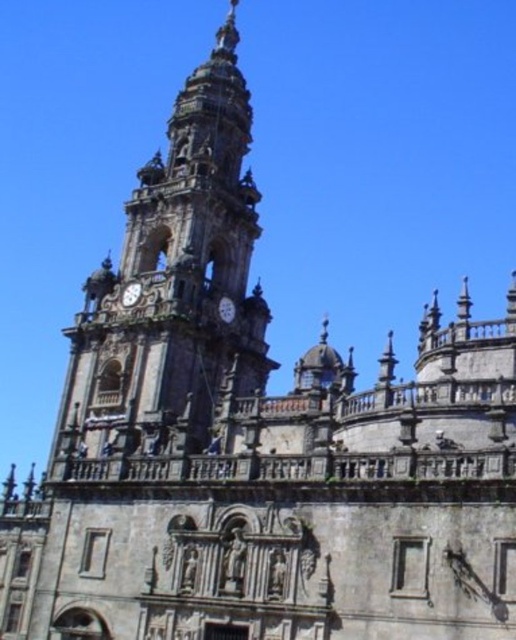
Question: Estimate the real-world distances between objects in this image. Which object is farther from the matte gray clock at center?

Choices:
 (A) silver metallic clock at center
 (B) stone clock tower at center

Answer: (B)

Question: Which of the following is the closest to the observer?

Choices:
 (A) stone clock tower at center
 (B) matte gray clock at center
 (C) silver metallic clock at center

Answer: (A)

Question: Is stone clock tower at center bigger than matte gray clock at center?

Choices:
 (A) yes
 (B) no

Answer: (A)

Question: Is stone clock tower at center positioned at the back of silver metallic clock at center?

Choices:
 (A) yes
 (B) no

Answer: (B)

Question: Is stone clock tower at center to the left of matte gray clock at center from the viewer's perspective?

Choices:
 (A) yes
 (B) no

Answer: (A)

Question: Which point is closer to the camera?

Choices:
 (A) (238, 188)
 (B) (136, 301)
 (C) (223, 298)

Answer: (B)